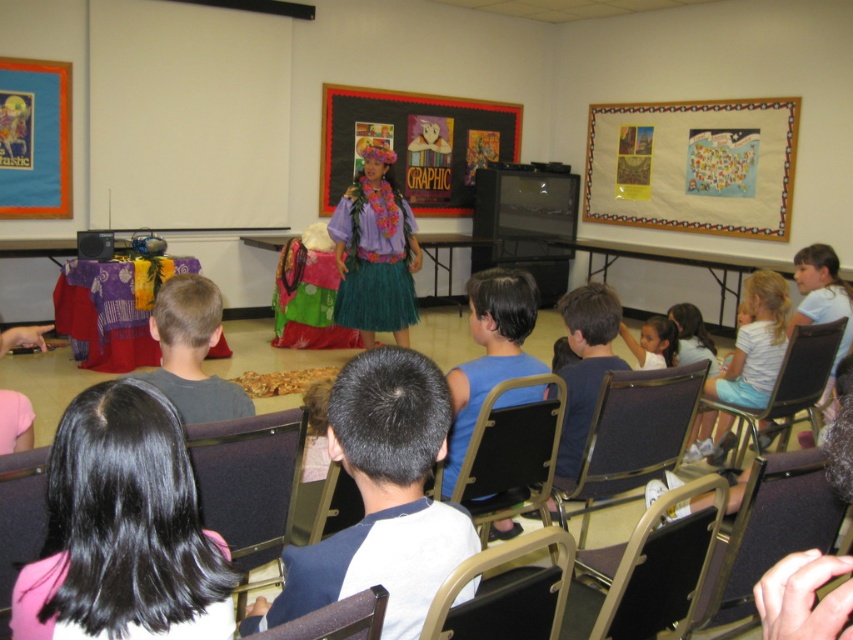
Can you confirm if black leather chair at lower center is positioned above brown leather chair at lower center?

Incorrect, black leather chair at lower center is not positioned above brown leather chair at lower center.

Between point (489, 570) and point (343, 609), which one is positioned behind?

The point (489, 570) is behind.

You are a GUI agent. You are given a task and a screenshot of the screen. Output one action in this format:
    pyautogui.click(x=<x>, y=<y>)
    Task: Click on the black leather chair at lower center
    The image size is (853, 640).
    Given the screenshot: What is the action you would take?
    pyautogui.click(x=506, y=593)

Can you confirm if black fabric chair at lower center is smaller than black plastic chair at right?

Yes.

Who is positioned more to the right, black fabric chair at lower center or black plastic chair at right?

black plastic chair at right is more to the right.

Who is more distant from viewer, (245, 497) or (805, 397)?

Point (805, 397)

Locate an element on the screen. The image size is (853, 640). black fabric chair at lower center is located at coordinates (248, 484).

In the scene shown: Which of these two, teal grass skirt at center or pink fabric chair at lower left, stands taller?

With more height is teal grass skirt at center.

Is point (396, 220) farther from viewer compared to point (4, 493)?

That is True.

Who is more distant from viewer, (392, 301) or (32, 524)?

Positioned behind is point (392, 301).

Identify the location of teal grass skirt at center. (373, 262).